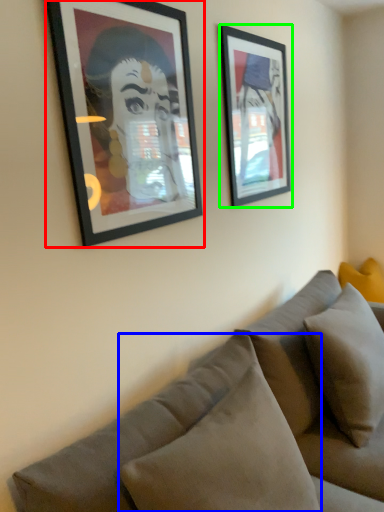
Question: Which object is positioned farthest from picture frame (highlighted by a red box)? Select from pillow (highlighted by a blue box) and picture frame (highlighted by a green box).

Choices:
 (A) pillow
 (B) picture frame

Answer: (A)